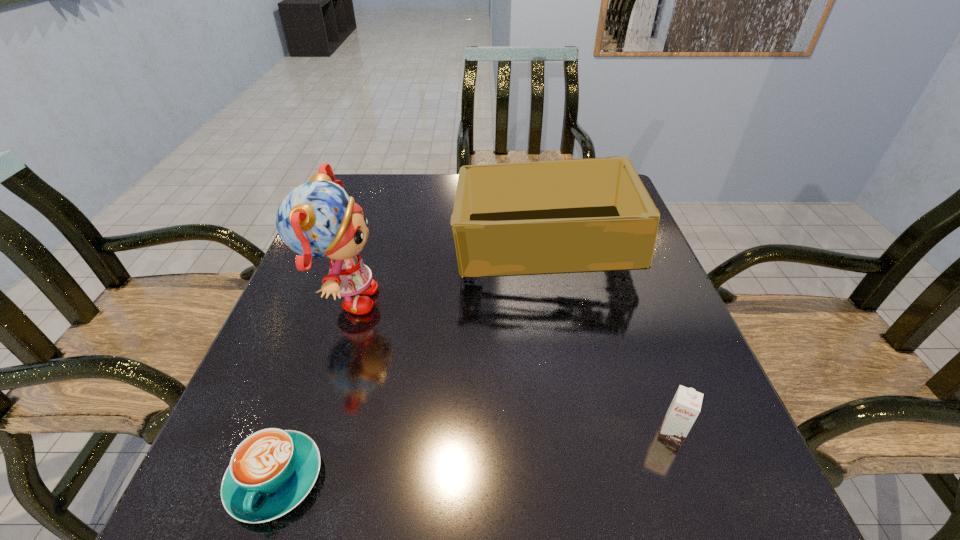
Identify which object is located as the third nearest to the chocolate milk. Please provide its 2D coordinates. Your answer should be formatted as a tuple, i.e. [(x, y)], where the tuple contains the x and y coordinates of a point satisfying the conditions above.

[(271, 471)]

You are a GUI agent. You are given a task and a screenshot of the screen. Output one action in this format:
    pyautogui.click(x=<x>, y=<y>)
    Task: Click on the second closest object relative to the chocolate milk
    
    Given the screenshot: What is the action you would take?
    pyautogui.click(x=317, y=219)

What are the coordinates of `vacant area that satisfies the following two spatial constraints: 1. on the face of the chocolate milk; 2. on the right side of the doll` in the screenshot? It's located at (300, 433).

Locate an element on the screen. vacant space that satisfies the following two spatial constraints: 1. on the face of the tallest object; 2. with the handle on the right side of the shortest object is located at coordinates (285, 478).

Locate an element on the screen. free point that satisfies the following two spatial constraints: 1. on the front side of the box; 2. on the face of the tallest object is located at coordinates (561, 301).

I want to click on vacant area in the image that satisfies the following two spatial constraints: 1. on the face of the third tallest object; 2. on the left side of the tallest object, so click(x=300, y=433).

This screenshot has height=540, width=960. I want to click on free space in the image that satisfies the following two spatial constraints: 1. on the face of the tallest object; 2. on the right side of the chocolate milk, so click(x=300, y=433).